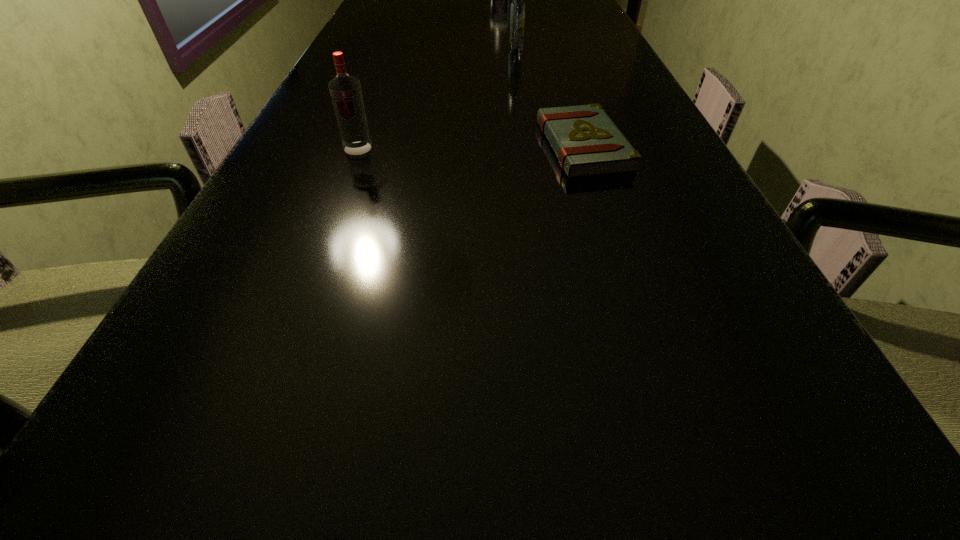
Point out which object is positioned as the second nearest to the nearer vodka. Please provide its 2D coordinates. Your answer should be formatted as a tuple, i.e. [(x, y)], where the tuple contains the x and y coordinates of a point satisfying the conditions above.

[(517, 9)]